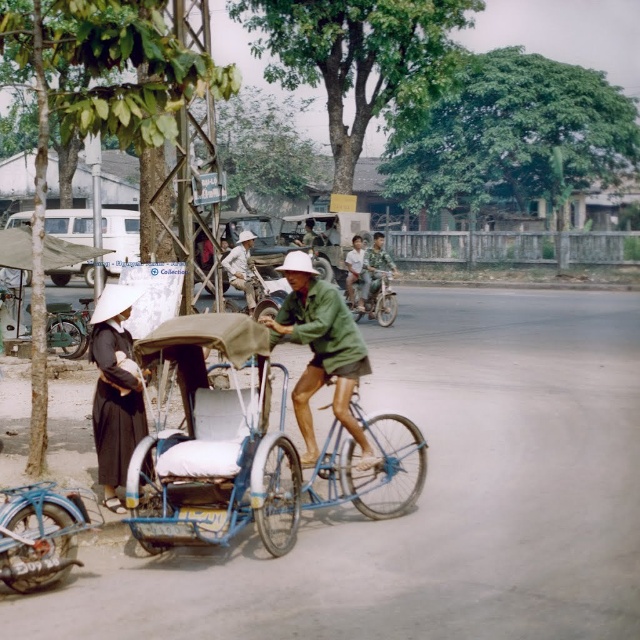
Measure the distance between black matte dress at left and camera.

The distance of black matte dress at left from camera is 21.81 feet.

Does black matte dress at left have a larger size compared to camouflage fabric jacket at center?

Actually, black matte dress at left might be smaller than camouflage fabric jacket at center.

This screenshot has width=640, height=640. What do you see at coordinates (115, 390) in the screenshot?
I see `black matte dress at left` at bounding box center [115, 390].

The height and width of the screenshot is (640, 640). I want to click on black matte dress at left, so click(115, 390).

Does green matte jacket at center have a lesser height compared to black matte dress at left?

Indeed, green matte jacket at center has a lesser height compared to black matte dress at left.

Find the location of a particular element. green matte jacket at center is located at coordinates (321, 352).

Where is `green matte jacket at center`? The image size is (640, 640). green matte jacket at center is located at coordinates (321, 352).

From the picture: Between black matte dress at left and metallic silver motorcycle at center, which one is positioned lower?

black matte dress at left is below.

Which is above, black matte dress at left or metallic silver motorcycle at center?

metallic silver motorcycle at center is higher up.

What do you see at coordinates (115, 390) in the screenshot?
I see `black matte dress at left` at bounding box center [115, 390].

At what (x,y) coordinates should I click in order to perform the action: click on black matte dress at left. Please return your answer as a coordinate pair (x, y). The height and width of the screenshot is (640, 640). Looking at the image, I should click on (115, 390).